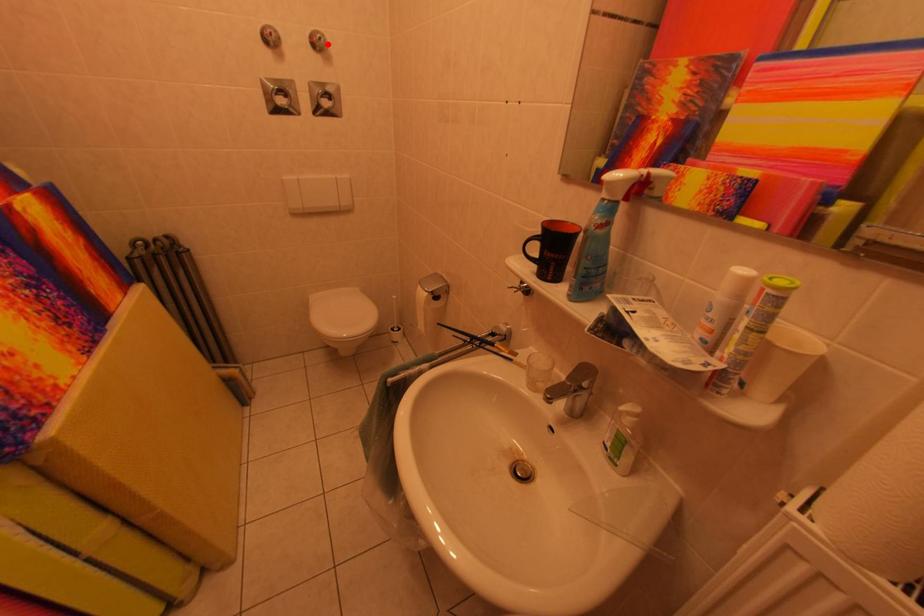
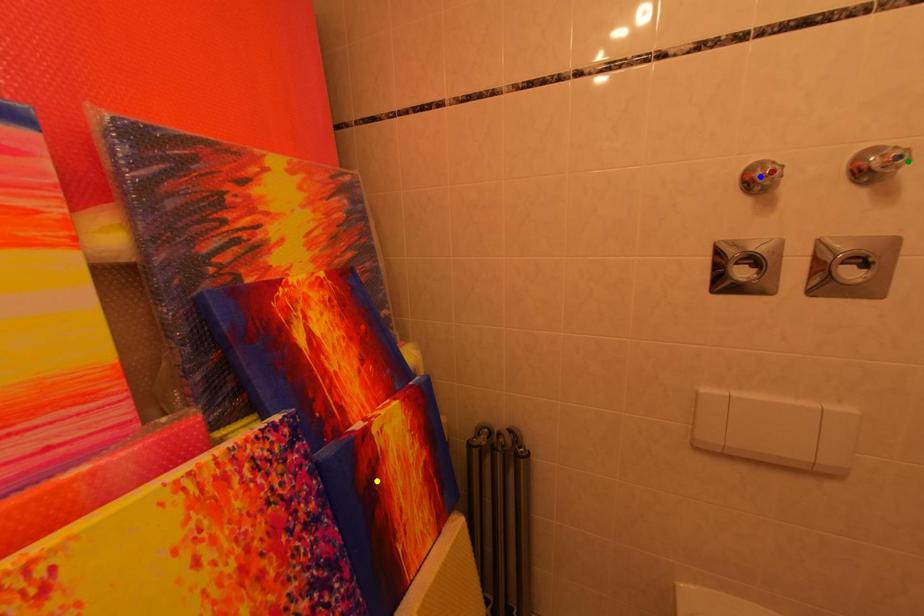
Question: I am providing you with two images of the same scene from different viewpoints. A red point is marked on the first image. You are given multiple points on the second image. Can you choose the point in image 2 that corresponds to the point in image 1?

Choices:
 (A) blue point
 (B) yellow point
 (C) green point

Answer: (C)